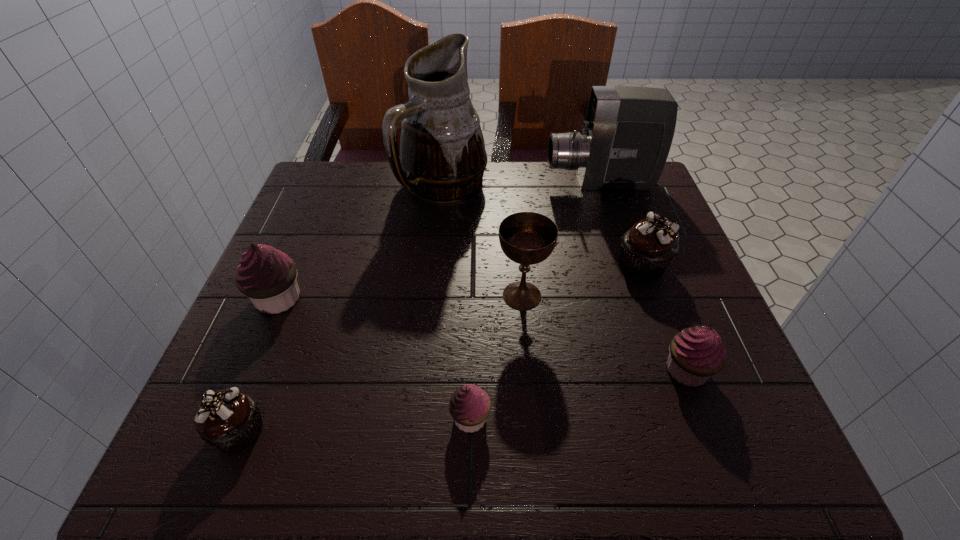
Locate an element on the screen. pitcher is located at coordinates (442, 159).

Where is `brown pitcher`? brown pitcher is located at coordinates (442, 159).

At what (x,y) coordinates should I click in order to perform the action: click on the seventh shortest object. Please return your answer as a coordinate pair (x, y). This screenshot has height=540, width=960. Looking at the image, I should click on (626, 137).

Identify the location of the fifth object from left to right. (527, 238).

The width and height of the screenshot is (960, 540). I want to click on the leftmost pink cupcake, so coord(267,276).

This screenshot has width=960, height=540. In order to click on the farthest pink cupcake in this screenshot , I will do `click(267, 276)`.

Where is `the farther brown cupcake`? The width and height of the screenshot is (960, 540). the farther brown cupcake is located at coordinates (650, 245).

Where is `the right brown cupcake`? This screenshot has width=960, height=540. the right brown cupcake is located at coordinates (650, 245).

Find the location of a particular element. The width and height of the screenshot is (960, 540). the second smallest pink cupcake is located at coordinates (696, 353).

Where is `the third nearest object`? the third nearest object is located at coordinates (696, 353).